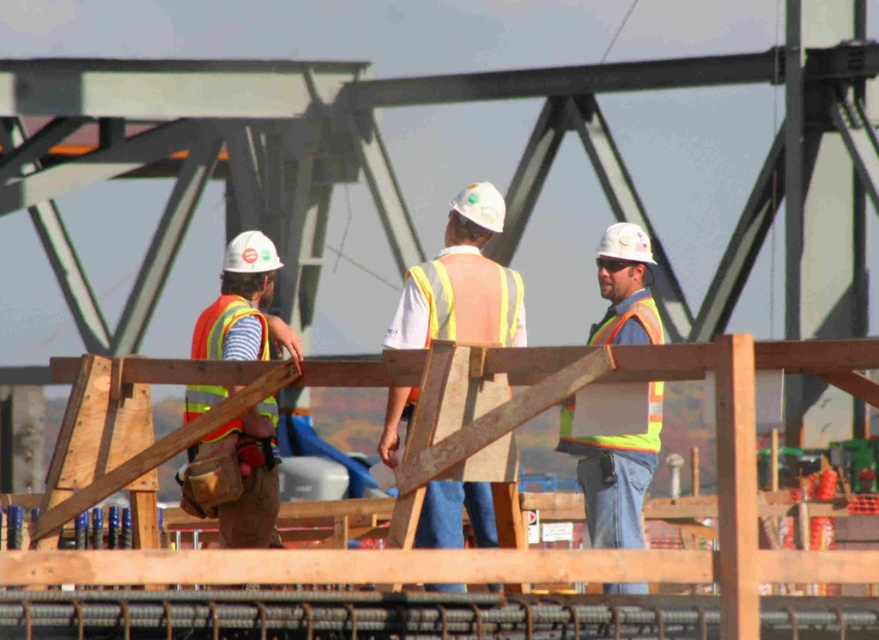
From the picture: Who is lower down, reflective orange vest at left or reflective yellow-green safety vest at right?

reflective orange vest at left

Who is positioned more to the right, reflective orange vest at left or reflective yellow-green safety vest at right?

From the viewer's perspective, reflective yellow-green safety vest at right appears more on the right side.

Is point (231, 518) positioned after point (563, 422)?

No, (231, 518) is in front of (563, 422).

The width and height of the screenshot is (879, 640). I want to click on reflective orange vest at left, so click(244, 307).

Is reflective orange vest at left bigger than reflective orange safety vest at left?

Indeed, reflective orange vest at left has a larger size compared to reflective orange safety vest at left.

Which is behind, point (237, 257) or point (220, 300)?

Point (220, 300)

Which is in front, point (269, 316) or point (200, 326)?

Point (200, 326) is in front.

The height and width of the screenshot is (640, 879). Find the location of `reflective orange vest at left`. reflective orange vest at left is located at coordinates pos(244,307).

Is reflective orange vest at center to the left of reflective orange safety vest at left from the viewer's perspective?

No, reflective orange vest at center is not to the left of reflective orange safety vest at left.

Is reflective orange vest at center below reflective orange safety vest at left?

Yes, reflective orange vest at center is below reflective orange safety vest at left.

Who is more distant from viewer, (495, 276) or (219, 314)?

The point (495, 276) is more distant.

I want to click on reflective orange vest at center, so click(x=462, y=284).